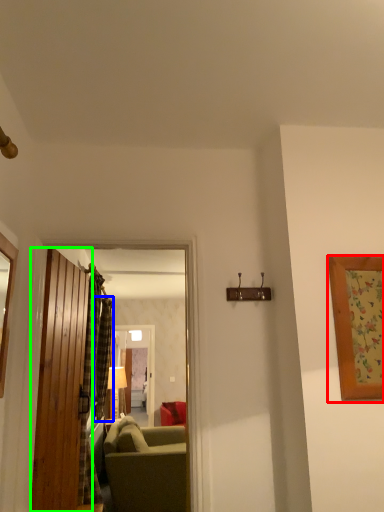
Question: Which is farther away from picture frame (highlighted by a red box)? curtain (highlighted by a blue box) or door (highlighted by a green box)?

Choices:
 (A) curtain
 (B) door

Answer: (A)